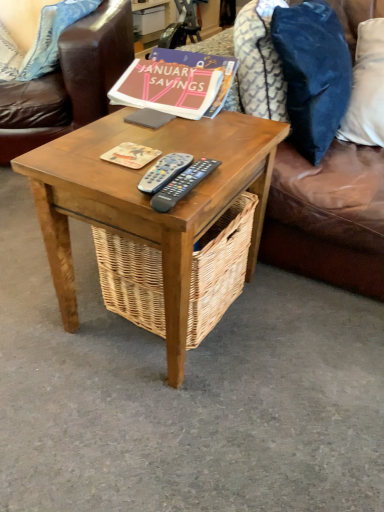
Where is `empty space that is to the right of wooden side table at center`? This screenshot has width=384, height=512. empty space that is to the right of wooden side table at center is located at coordinates (307, 333).